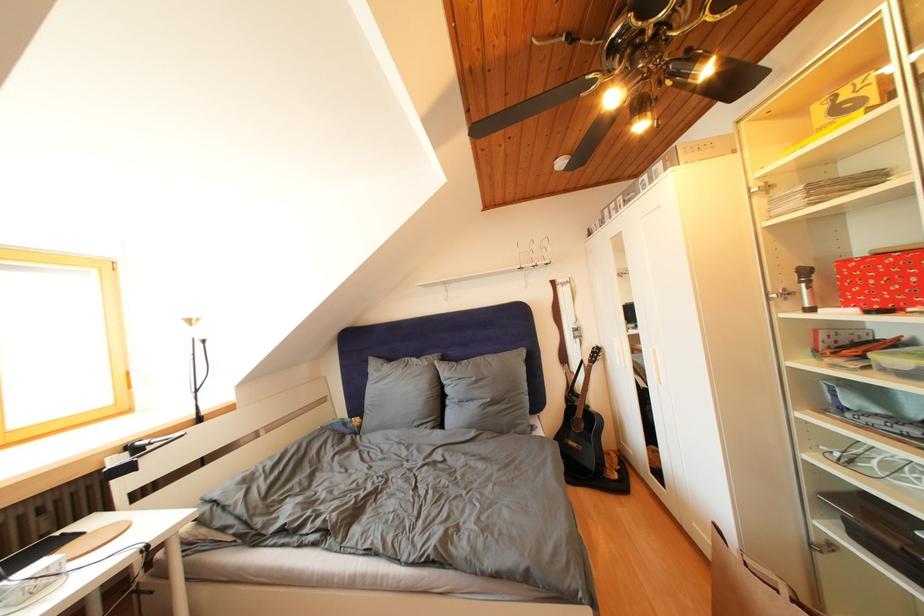
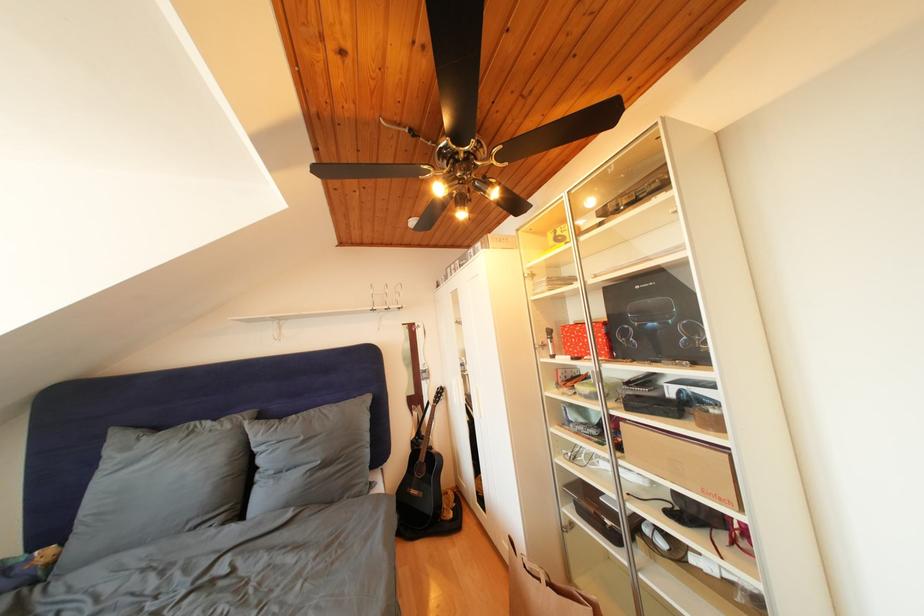
In the second image, find the point that corresponds to point (796, 300) in the first image.

(552, 351)